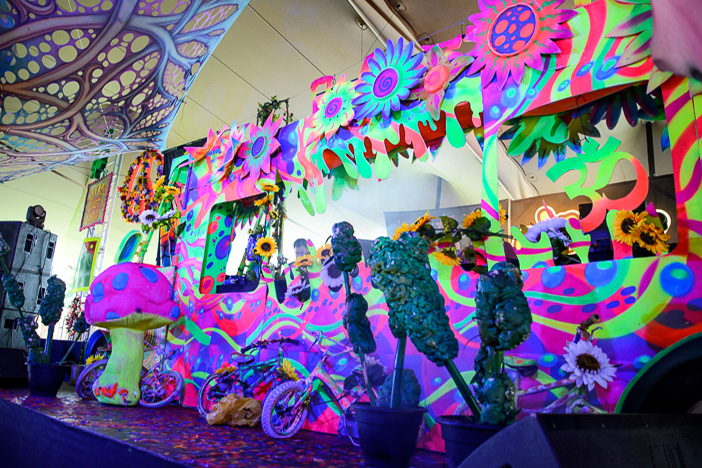
Where is `floor`? The image size is (702, 468). floor is located at coordinates (164, 445).